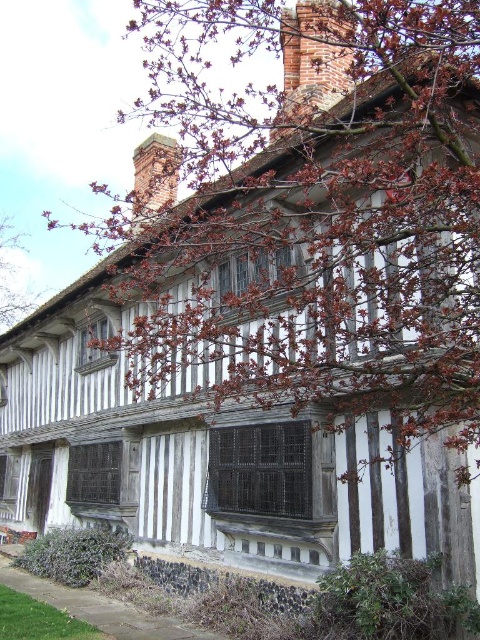
Question: Is brown wood tree at upper center thinner than dark brown brick chimney at upper center?

Choices:
 (A) no
 (B) yes

Answer: (A)

Question: Does brown wood tree at upper center have a smaller size compared to red brick chimney at upper center?

Choices:
 (A) no
 (B) yes

Answer: (A)

Question: Is brown wood tree at upper center above brown textured tree at upper left?

Choices:
 (A) yes
 (B) no

Answer: (A)

Question: Which point is farther to the camera?

Choices:
 (A) dark brown brick chimney at upper center
 (B) red brick chimney at upper center

Answer: (A)

Question: Estimate the real-world distances between objects in this image. Which object is farther from the red brick chimney at upper center?

Choices:
 (A) brown wood tree at upper center
 (B) brown textured tree at upper left

Answer: (B)

Question: Which of the following is the farthest from the observer?

Choices:
 (A) brown textured tree at upper left
 (B) dark brown brick chimney at upper center

Answer: (A)